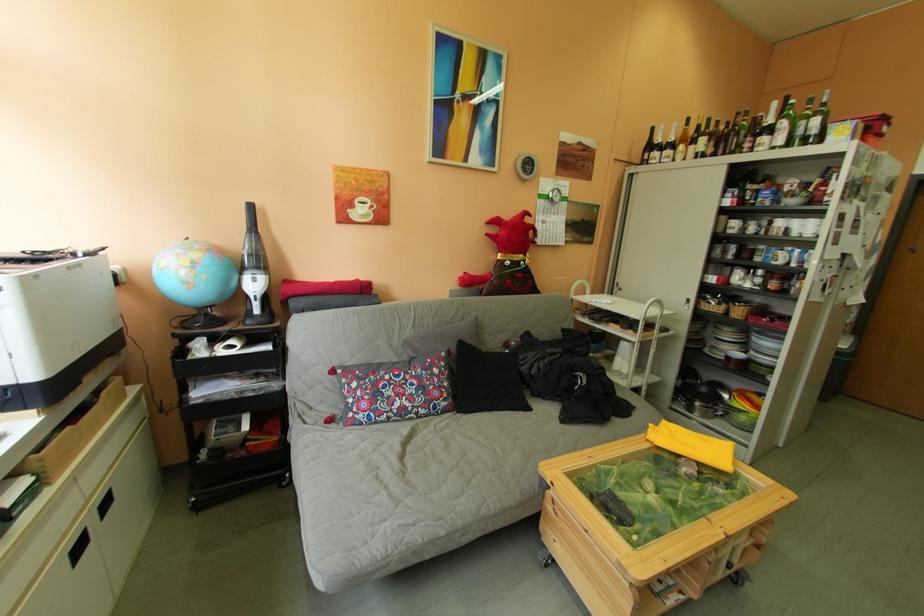
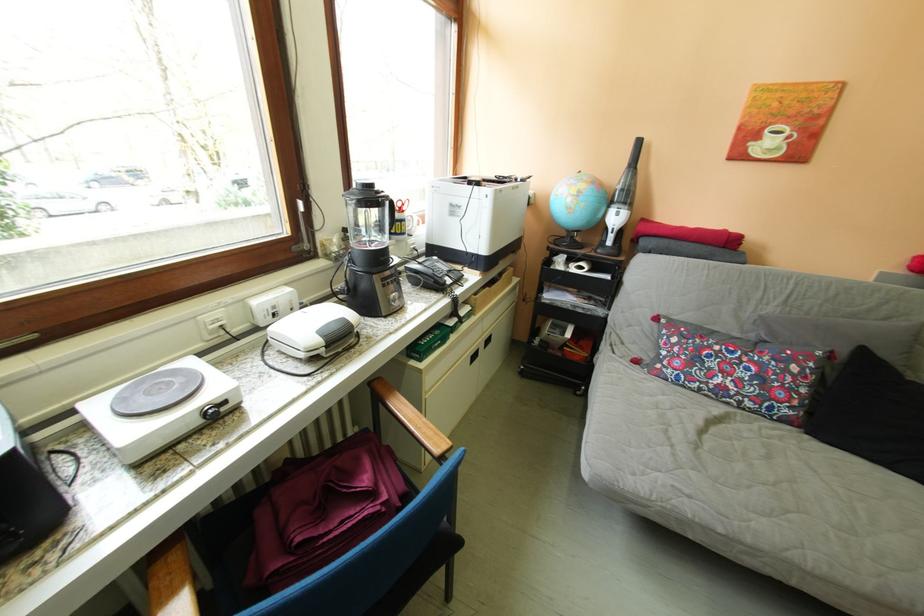
Where in the second image is the point corresponding to pixel 207 265 from the first image?

(591, 195)